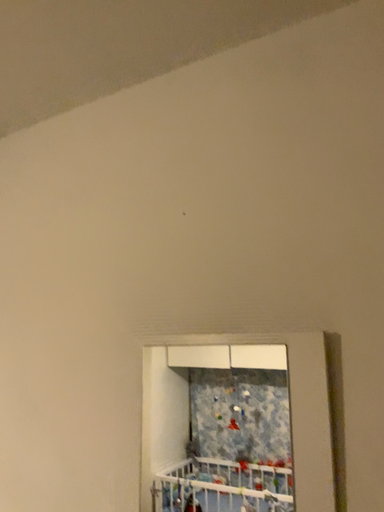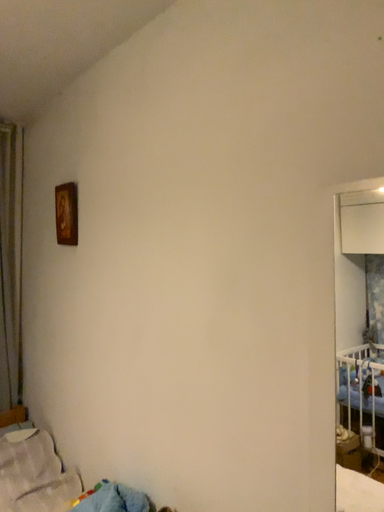
Question: Which way did the camera rotate in the video?

Choices:
 (A) rotated left
 (B) rotated right

Answer: (A)